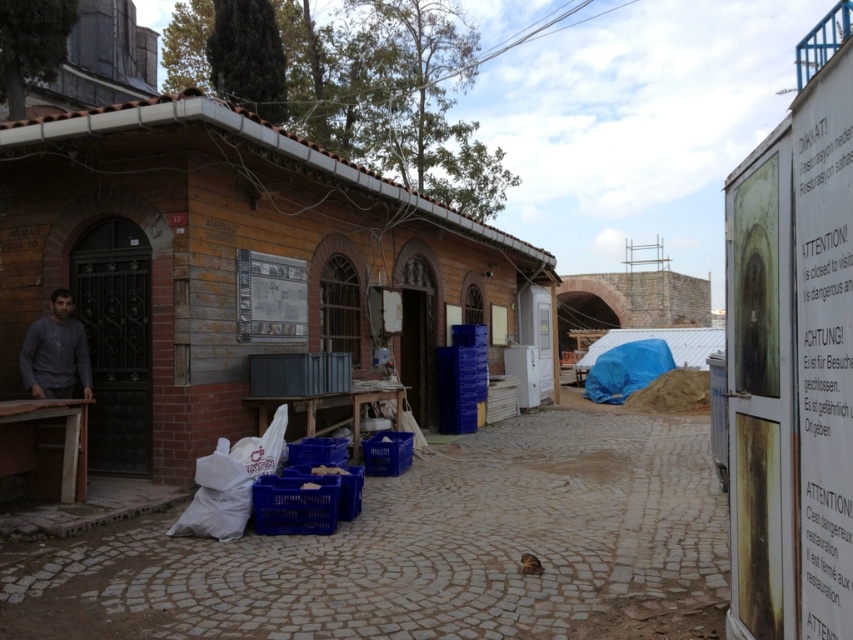
Question: Can you confirm if brown wooden hut at left is smaller than gray matte shirt at left?

Choices:
 (A) no
 (B) yes

Answer: (A)

Question: Can you confirm if brown wooden hut at left is bigger than blue plastic crate at lower center?

Choices:
 (A) yes
 (B) no

Answer: (A)

Question: Among these objects, which one is nearest to the camera?

Choices:
 (A) blue plastic crate at lower center
 (B) brown wooden hut at left
 (C) smooth cobblestone alley at center
 (D) gray matte shirt at left

Answer: (C)

Question: Where is brown wooden hut at left located in relation to blue plastic crate at lower center in the image?

Choices:
 (A) left
 (B) right

Answer: (B)

Question: Which object appears closest to the camera in this image?

Choices:
 (A) gray matte shirt at left
 (B) blue plastic crate at lower center

Answer: (B)

Question: Which of the following is the farthest from the observer?

Choices:
 (A) (393, 604)
 (B) (113, 172)
 (C) (68, 333)

Answer: (B)